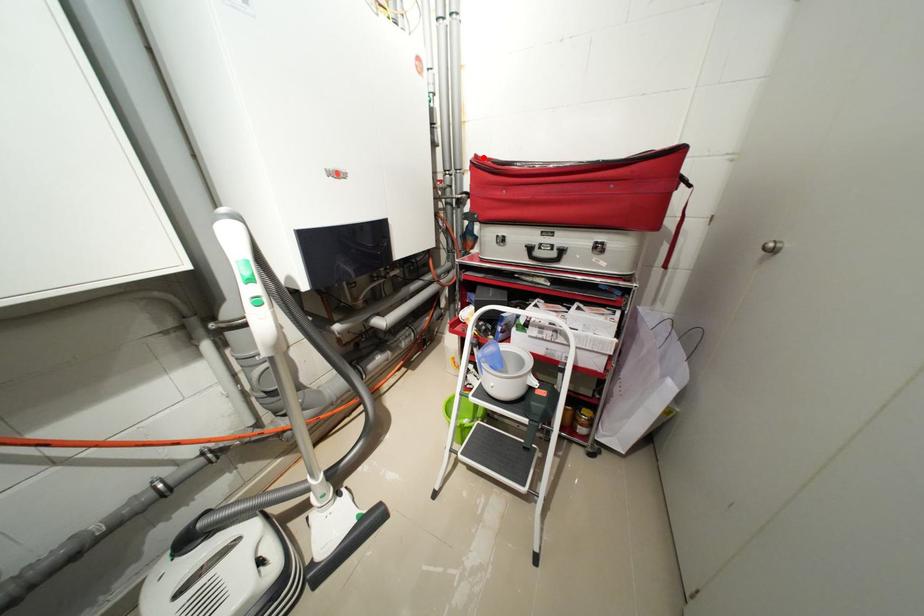
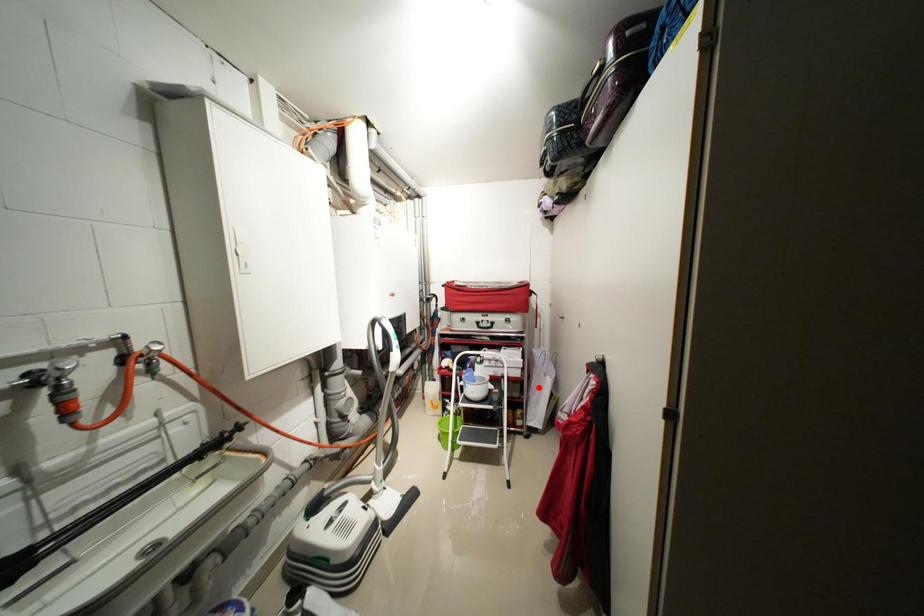
I am providing you with two images of the same scene from different viewpoints. A red point is marked on the first image and another point is marked on the second image. Do the highlighted points in image1 and image2 indicate the same real-world spot?

No